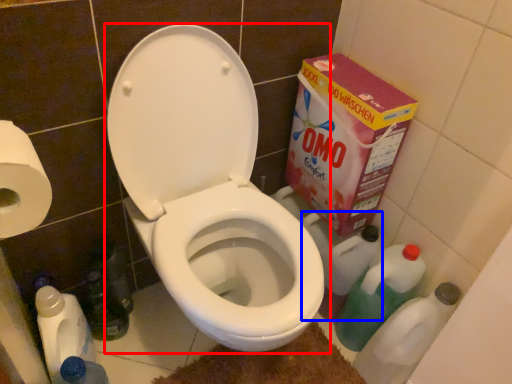
Question: Which point is further to the camera, toilet (highlighted by a red box) or cleaning product (highlighted by a blue box)?

Choices:
 (A) toilet
 (B) cleaning product

Answer: (B)